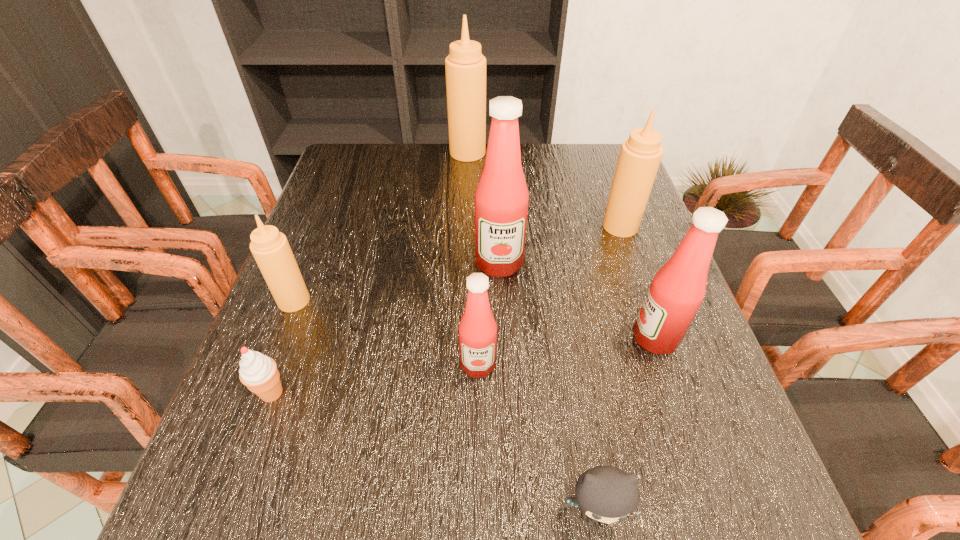
At what (x,y) coordinates should I click in order to perform the action: click on free spot located on the front-facing side of the smallest red condiment. Please return your answer as a coordinate pair (x, y). Looking at the image, I should click on (478, 440).

Where is `vacant area situated 0.200m on the right of the red icecream`? Image resolution: width=960 pixels, height=540 pixels. vacant area situated 0.200m on the right of the red icecream is located at coordinates (402, 393).

You are a GUI agent. You are given a task and a screenshot of the screen. Output one action in this format:
    pyautogui.click(x=<x>, y=<y>)
    Task: Click on the object that is at the far edge
    
    Given the screenshot: What is the action you would take?
    pyautogui.click(x=465, y=66)

Identify the location of object that is at the near edge. (606, 494).

Image resolution: width=960 pixels, height=540 pixels. In order to click on condiment located at the left edge in this screenshot , I will do `click(270, 248)`.

In order to click on icecream located at the left edge in this screenshot , I will do `click(258, 372)`.

Identify the location of free location at the far edge of the desktop. (442, 159).

Locate an element on the screen. The image size is (960, 540). vacant space at the near edge of the desktop is located at coordinates click(x=535, y=528).

Where is `vacant region at the left edge of the desktop`? Image resolution: width=960 pixels, height=540 pixels. vacant region at the left edge of the desktop is located at coordinates (239, 426).

In the image, there is a desktop. At what (x,y) coordinates should I click in order to perform the action: click on vacant space at the right edge. Please return your answer as a coordinate pair (x, y). This screenshot has width=960, height=540. Looking at the image, I should click on (637, 394).